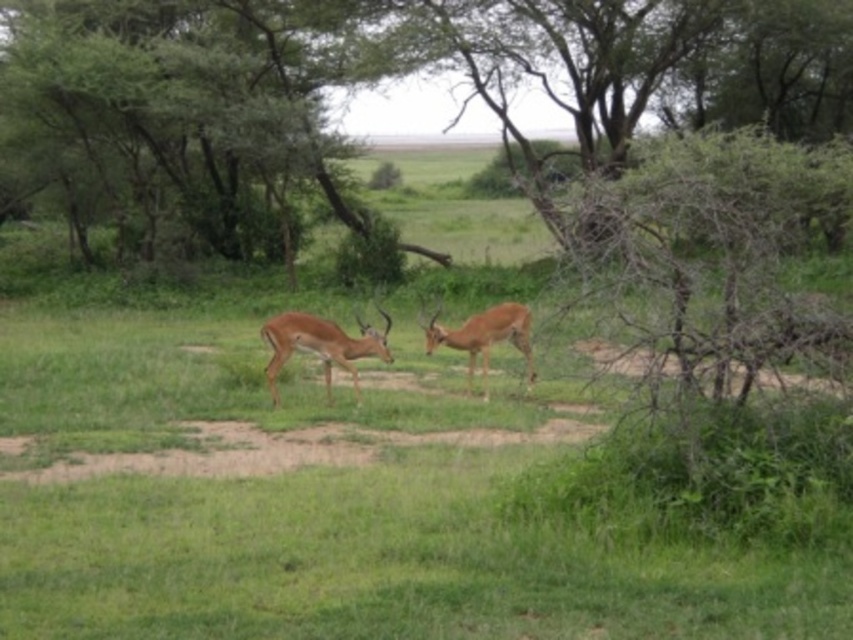
Question: Which point appears closest to the camera in this image?

Choices:
 (A) (222, 115)
 (B) (485, 374)
 (C) (270, 342)

Answer: (C)

Question: Among these objects, which one is farthest from the camera?

Choices:
 (A) brown matte antelope at center
 (B) green leafy tree at center

Answer: (A)

Question: From the image, what is the correct spatial relationship of green leafy tree at center in relation to brown matte deer at center?

Choices:
 (A) left
 (B) right

Answer: (B)

Question: Does brown matte deer at center have a greater width compared to brown matte antelope at center?

Choices:
 (A) no
 (B) yes

Answer: (B)

Question: Can you confirm if green leafy tree at center is positioned to the right of brown matte antelope at center?

Choices:
 (A) no
 (B) yes

Answer: (B)

Question: Which of the following is the farthest from the observer?

Choices:
 (A) (361, 346)
 (B) (814, 33)
 (C) (451, 336)

Answer: (B)